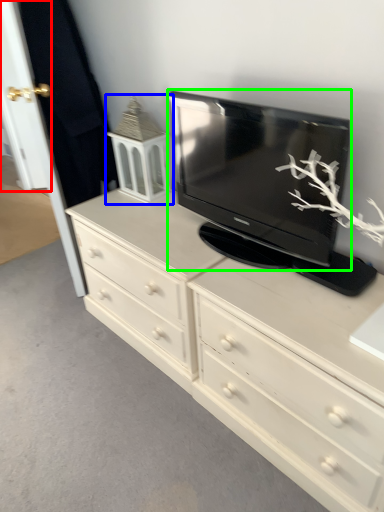
Question: Based on their relative distances, which object is farther from door (highlighted by a red box)? Choose from tv cabinet (highlighted by a blue box) and television (highlighted by a green box).

Choices:
 (A) tv cabinet
 (B) television

Answer: (B)